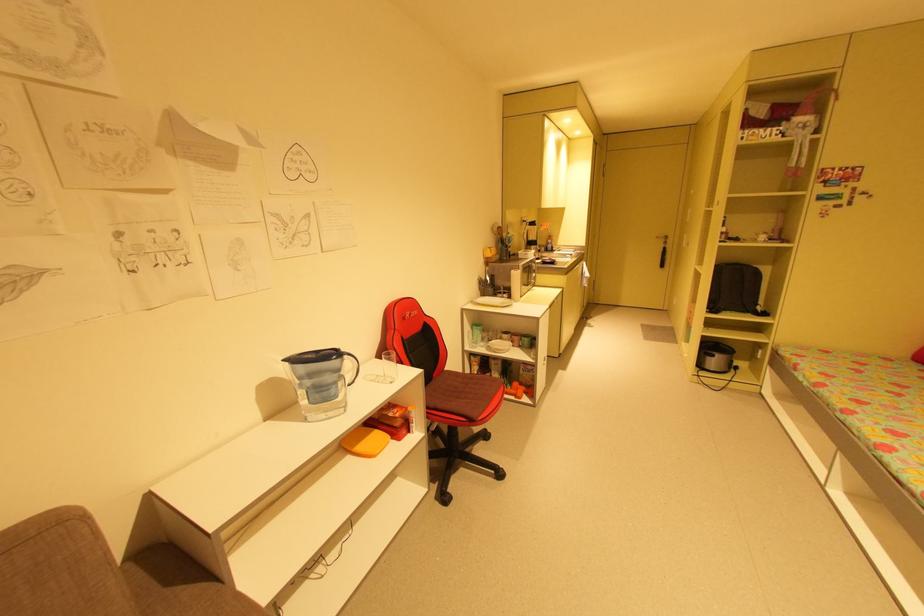
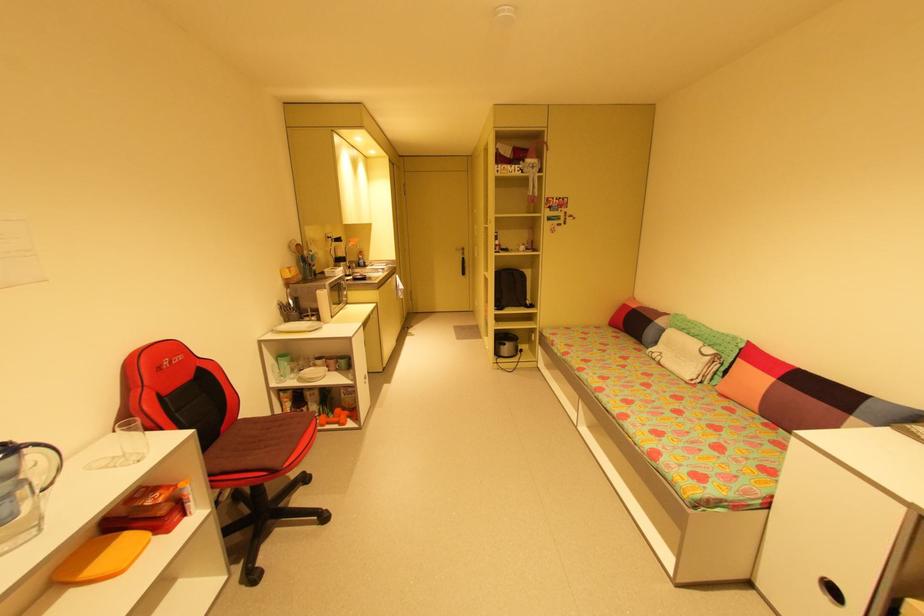
Find the pixel in the second image that matches (661,238) in the first image.

(460, 249)